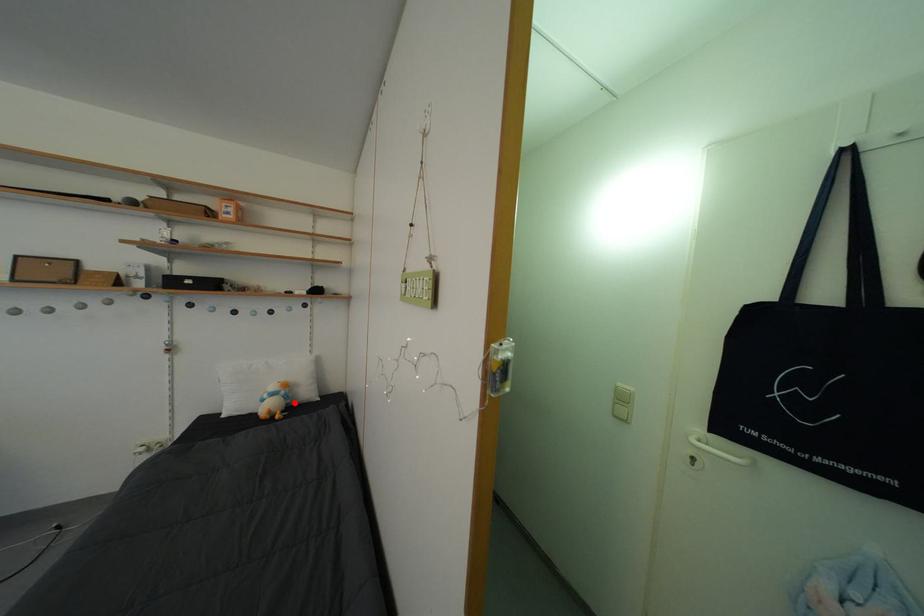
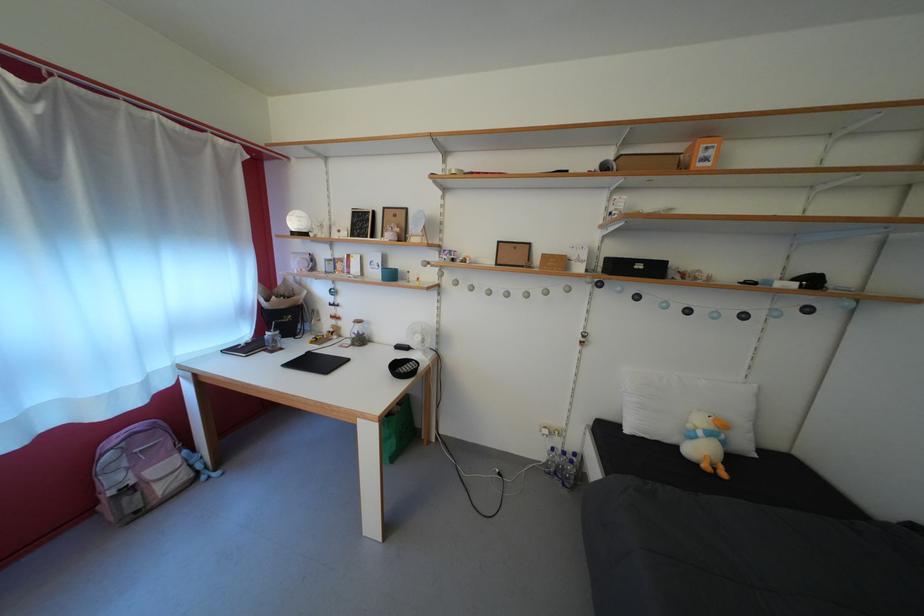
Find the pixel in the second image that matches the highlighted location in the first image.

(732, 448)